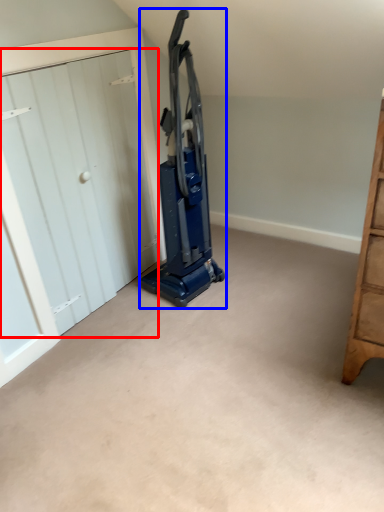
Question: Which object appears farthest to the camera in this image, door (highlighted by a red box) or equipment (highlighted by a blue box)?

Choices:
 (A) door
 (B) equipment

Answer: (B)